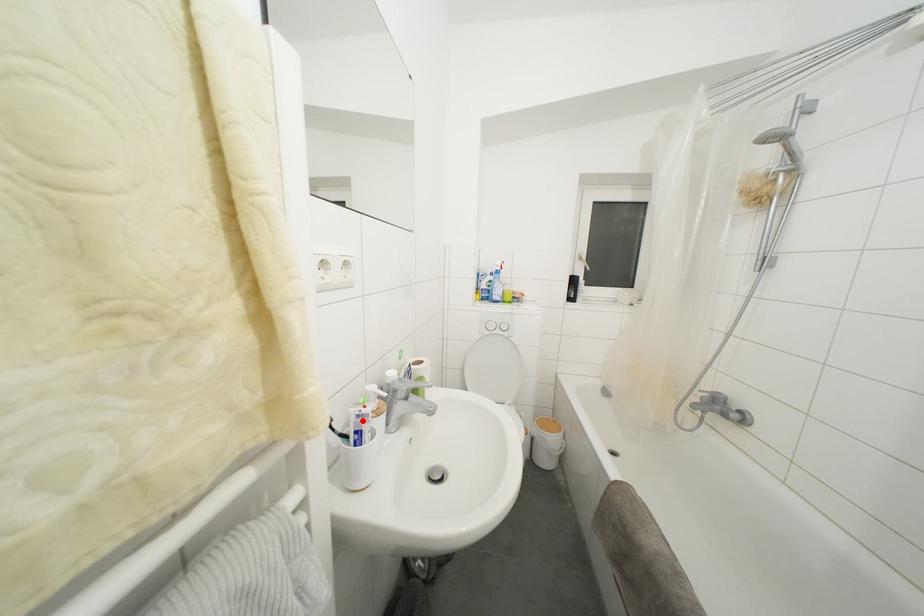
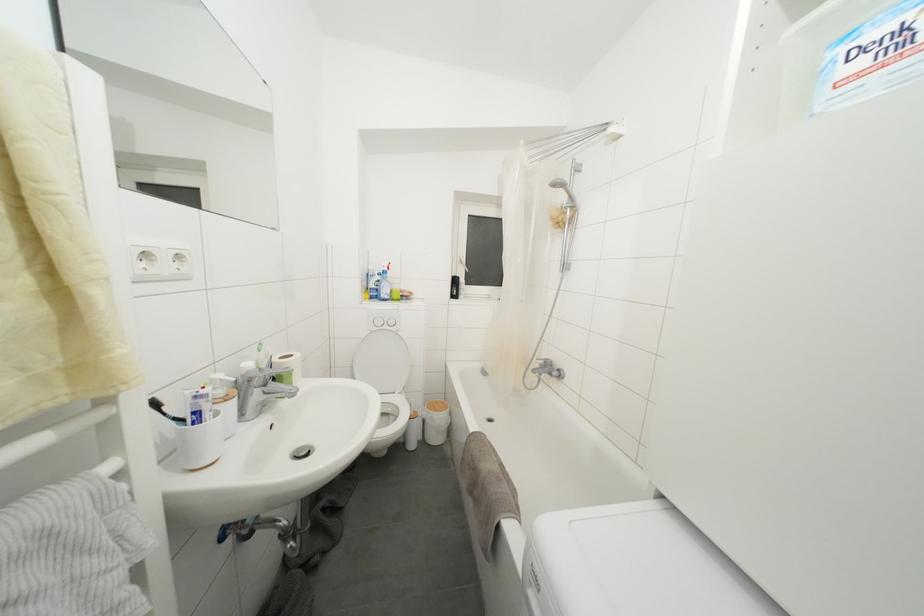
Locate, in the second image, the point that corresponds to the highlighted location in the first image.

(200, 402)